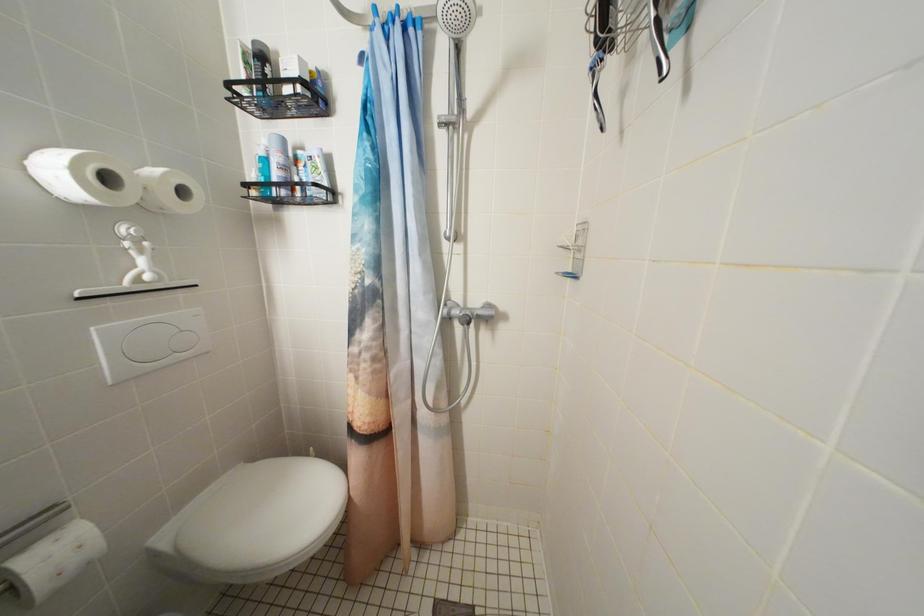
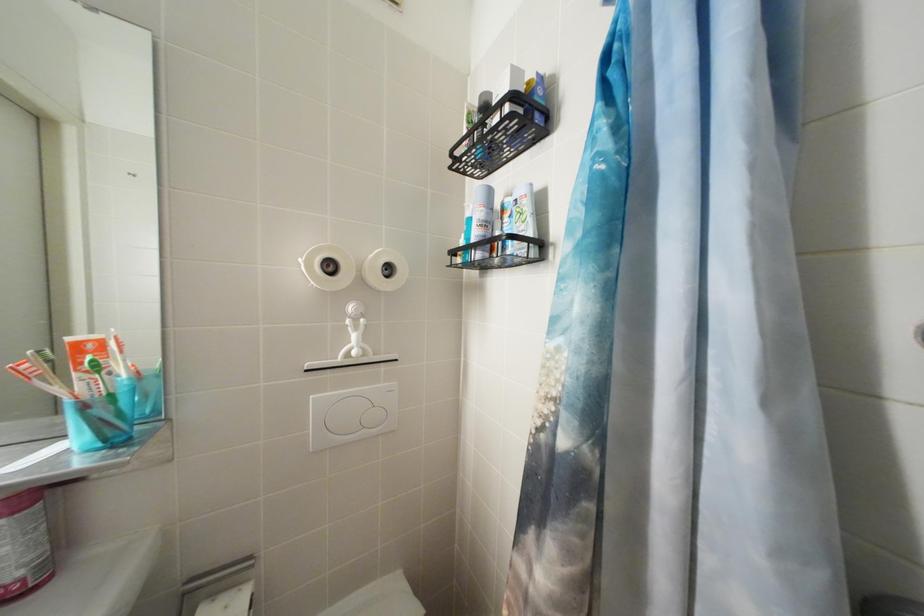
Question: The images are taken continuously from a first-person perspective. In which direction is your viewpoint rotating?

Choices:
 (A) Left
 (B) Right
 (C) Up
 (D) Down

Answer: (A)